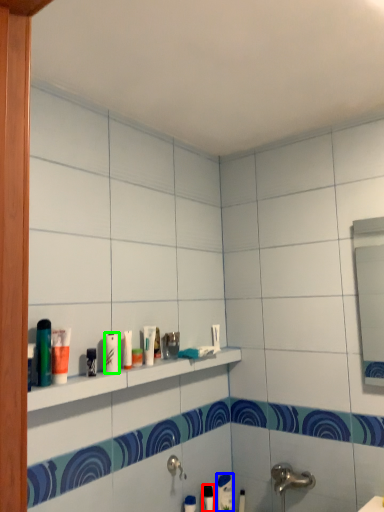
Question: Which object is positioned farthest from toiletry (highlighted by a red box)? Select from toothpaste (highlighted by a blue box) and toiletry (highlighted by a green box).

Choices:
 (A) toothpaste
 (B) toiletry

Answer: (B)